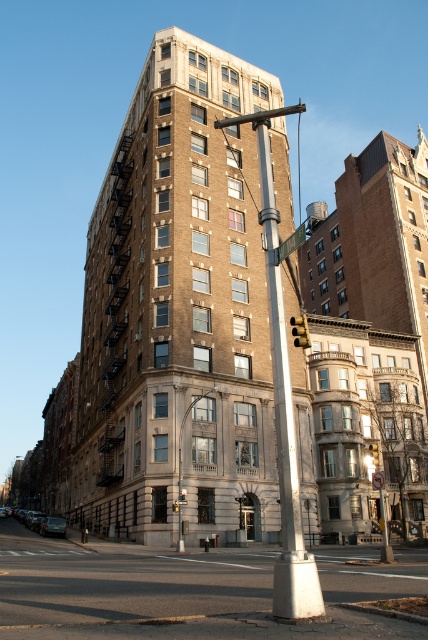
Which is behind, point (181, 525) or point (300, 332)?

Positioned behind is point (181, 525).

Which is in front, point (181, 499) or point (303, 321)?

Point (303, 321) is more forward.

Where is `polished brass lamp post at center`? Image resolution: width=428 pixels, height=640 pixels. polished brass lamp post at center is located at coordinates (181, 468).

Which is more to the right, white metallic pole at center or metallic silver street sign at center?

From the viewer's perspective, metallic silver street sign at center appears more on the right side.

Does white metallic pole at center have a lesser width compared to metallic silver street sign at center?

No, white metallic pole at center is not thinner than metallic silver street sign at center.

Who is more distant from viewer, [296,513] or [291,236]?

The point [291,236] is behind.

At what (x,y) coordinates should I click in order to perform the action: click on white metallic pole at center. Please return your answer as a coordinate pair (x, y). This screenshot has height=640, width=428. Looking at the image, I should click on (282, 403).

Between white metallic pole at center and yellow/golden metal traffic light at center, which one has less height?

yellow/golden metal traffic light at center is shorter.

Does white metallic pole at center appear on the left side of yellow/golden metal traffic light at center?

Yes, white metallic pole at center is to the left of yellow/golden metal traffic light at center.

Is point (275, 600) in front of point (302, 317)?

Yes, it is in front of point (302, 317).

What are the coordinates of `white metallic pole at center` in the screenshot? It's located at (282, 403).